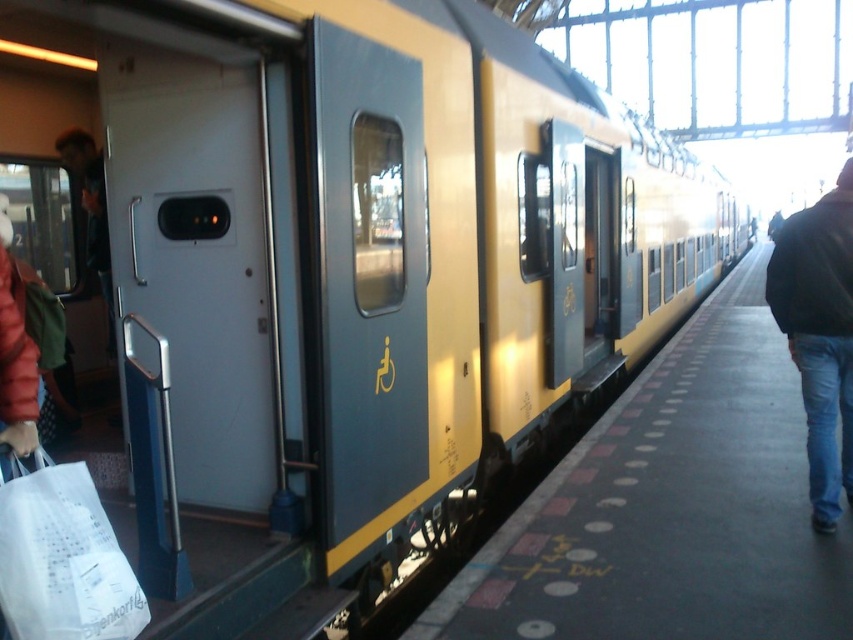
Who is positioned more to the right, white paper bag at lower left or black leather jacket at right?

black leather jacket at right is more to the right.

You are a GUI agent. You are given a task and a screenshot of the screen. Output one action in this format:
    pyautogui.click(x=<x>, y=<y>)
    Task: Click on the white paper bag at lower left
    
    Given the screenshot: What is the action you would take?
    pyautogui.click(x=62, y=557)

Does concrete platform at center appear on the left side of white paper bag at lower left?

Incorrect, concrete platform at center is not on the left side of white paper bag at lower left.

Who is more forward, (779,497) or (132,628)?

Point (132,628) is in front.

The image size is (853, 640). What do you see at coordinates (671, 508) in the screenshot? I see `concrete platform at center` at bounding box center [671, 508].

Identify the location of concrete platform at center. (671, 508).

Does point (639, 384) lie in front of point (804, 312)?

No, it is not.

Is point (666, 465) closer to viewer compared to point (846, 358)?

No.

The image size is (853, 640). Find the location of `concrete platform at center`. concrete platform at center is located at coordinates (671, 508).